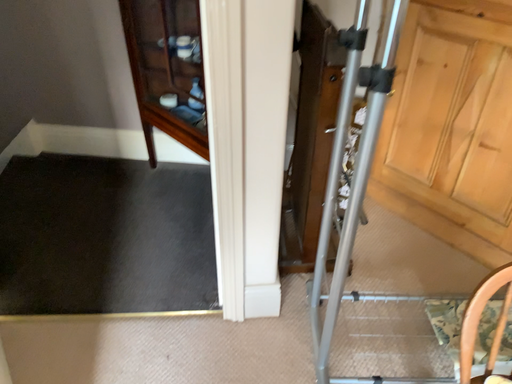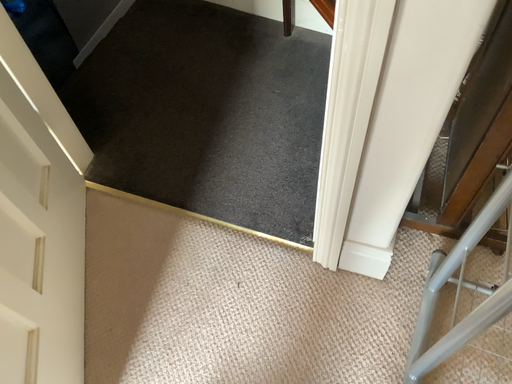
Question: How did the camera likely rotate when shooting the video?

Choices:
 (A) rotated upward
 (B) rotated downward

Answer: (B)